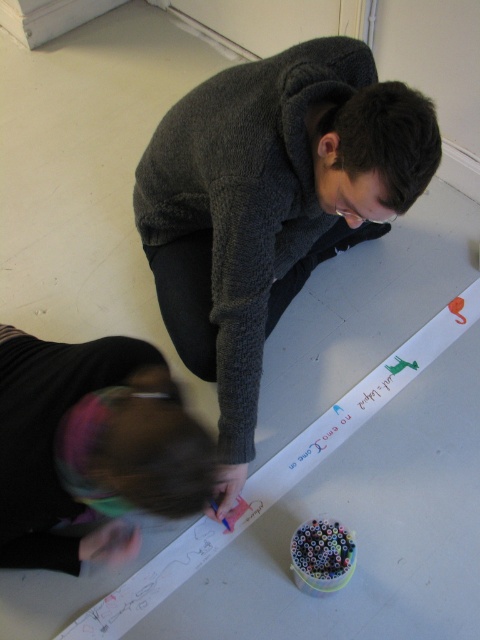
Between dark gray sweater at upper center and black hair at lower left, which one appears on the right side from the viewer's perspective?

Positioned to the right is dark gray sweater at upper center.

Between dark gray sweater at upper center and black hair at lower left, which one is positioned lower?

black hair at lower left is below.

Who is more forward, (328, 186) or (158, 428)?

Point (158, 428) is in front.

This screenshot has width=480, height=640. What are the coordinates of `dark gray sweater at upper center` in the screenshot? It's located at (269, 204).